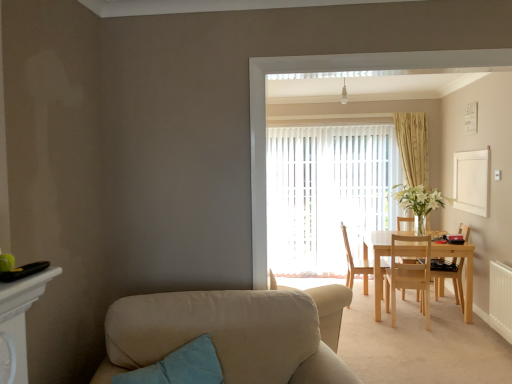
In order to face teal fabric pillow at lower left, should I rotate leftwards or rightwards?

You should rotate left by 31.275 degrees.

What is the approximate height of white vertical blinds at center?

white vertical blinds at center is 6.63 feet in height.

What is the approximate width of teal fabric pillow at lower left?

35.31 centimeters.

Measure the distance between light wood chair at right, the third chair when ordered from left to right, and camera.

The distance of light wood chair at right, the third chair when ordered from left to right, from camera is 3.97 meters.

What is the approximate width of beige textured curtain at center?

The width of beige textured curtain at center is 5.04 inches.

Find the location of a particular element. light wood table at center is located at coordinates (379, 259).

I want to click on light wood chair at center, which is the second chair from left to right, so click(x=409, y=271).

In order to face light wood chair at center, which is the second chair from left to right, should I rotate leftwards or rightwards?

Turn right by 19.806 degrees to look at light wood chair at center, which is the second chair from left to right.

Find the location of a particular element. This screenshot has width=512, height=384. teal fabric pillow at lower left is located at coordinates (7, 262).

Measure the distance from white textured radiator at lower right to beige textured curtain at center.

2.28 meters.

Where is `curtain that appears above the white textured radiator at lower right (from a real-world perspective)`? The width and height of the screenshot is (512, 384). curtain that appears above the white textured radiator at lower right (from a real-world perspective) is located at coordinates (413, 146).

Is white textured radiator at lower right aimed at beige textured curtain at center?

No, white textured radiator at lower right is not facing towards beige textured curtain at center.

Considering the relative sizes of beige fabric couch at lower left and light wood chair at center, which ranks as the first chair in left-to-right order, in the image provided, is beige fabric couch at lower left bigger than light wood chair at center, which ranks as the first chair in left-to-right order,?

Yes, beige fabric couch at lower left is bigger than light wood chair at center, which ranks as the first chair in left-to-right order.

Considering the sizes of objects beige fabric couch at lower left and light wood chair at center, the 3th chair when ordered from right to left, in the image provided, who is shorter, beige fabric couch at lower left or light wood chair at center, the 3th chair when ordered from right to left,?

beige fabric couch at lower left is shorter.

Is beige fabric couch at lower left wider than light wood chair at center, the 3th chair when ordered from right to left?

Indeed, beige fabric couch at lower left has a greater width compared to light wood chair at center, the 3th chair when ordered from right to left.

Is beige fabric couch at lower left situated inside light wood chair at center, the 3th chair when ordered from right to left, or outside?

beige fabric couch at lower left cannot be found inside light wood chair at center, the 3th chair when ordered from right to left.

Does teal fabric pillow at lower left appear on the right side of light wood chair at right, the 1th chair in the right-to-left sequence?

Incorrect, teal fabric pillow at lower left is not on the right side of light wood chair at right, the 1th chair in the right-to-left sequence.

Is teal fabric pillow at lower left shorter than light wood chair at right, the third chair when ordered from left to right?

Yes, teal fabric pillow at lower left is shorter than light wood chair at right, the third chair when ordered from left to right.

Is teal fabric pillow at lower left not close to light wood chair at right, the 1th chair in the right-to-left sequence?

teal fabric pillow at lower left is far away from light wood chair at right, the 1th chair in the right-to-left sequence.

Find the location of a particular element. pillow on the left of white vertical blinds at center is located at coordinates (180, 366).

From a real-world perspective, relative to teal fabric pillow at lower left, is white vertical blinds at center vertically above or below?

Clearly, from a real-world perspective, white vertical blinds at center is above teal fabric pillow at lower left.

Is teal fabric pillow at lower left at the back of white vertical blinds at center?

That's not correct — white vertical blinds at center is not looking away from teal fabric pillow at lower left.

Looking at the image, does white vertical blinds at center seem bigger or smaller compared to teal fabric pillow at lower left?

white vertical blinds at center is bigger than teal fabric pillow at lower left.

Does light wood chair at center, arranged as the 2th chair when viewed from the right, turn towards white textured radiator at lower right?

No.

Based on their sizes in the image, would you say light wood chair at center, arranged as the 2th chair when viewed from the right, is bigger or smaller than white textured radiator at lower right?

Clearly, light wood chair at center, arranged as the 2th chair when viewed from the right, is larger in size than white textured radiator at lower right.

Which is correct: light wood chair at center, which is the second chair from left to right, is inside white textured radiator at lower right, or outside of it?

light wood chair at center, which is the second chair from left to right, is outside white textured radiator at lower right.

Which of these two, light wood chair at center, which is the second chair from left to right, or white textured radiator at lower right, is wider?

light wood chair at center, which is the second chair from left to right.

Does point (384, 267) appear closer or farther from the camera than point (507, 340)?

Point (384, 267) is positioned farther from the camera compared to point (507, 340).

How different are the orientations of light wood chair at center, the 3th chair when ordered from right to left, and white textured radiator at lower right in degrees?

176 degrees.

From a real-world perspective, which is physically above, light wood chair at center, the 3th chair when ordered from right to left, or white textured radiator at lower right?

From a 3D spatial view, light wood chair at center, the 3th chair when ordered from right to left, is above.

Does light wood chair at center, which ranks as the first chair in left-to-right order, have a smaller size compared to white textured radiator at lower right?

No, light wood chair at center, which ranks as the first chair in left-to-right order, is not smaller than white textured radiator at lower right.

Considering the sizes of objects beige fabric couch at lower left and light wood chair at center, arranged as the 2th chair when viewed from the right, in the image provided, who is bigger, beige fabric couch at lower left or light wood chair at center, arranged as the 2th chair when viewed from the right,?

beige fabric couch at lower left.

Does beige fabric couch at lower left have a greater height compared to light wood chair at center, which is the second chair from left to right?

No.

From the picture: From a real-world perspective, is beige fabric couch at lower left above or below light wood chair at center, which is the second chair from left to right?

Clearly, from a real-world perspective, beige fabric couch at lower left is above light wood chair at center, which is the second chair from left to right.

Is beige fabric couch at lower left turned away from light wood chair at center, arranged as the 2th chair when viewed from the right?

That's not correct — beige fabric couch at lower left is not looking away from light wood chair at center, arranged as the 2th chair when viewed from the right.

Where is `radiator on the right of beige textured curtain at center`? This screenshot has width=512, height=384. radiator on the right of beige textured curtain at center is located at coordinates (500, 299).

Where is `studio couch that appears below the light wood chair at center, which ranks as the first chair in left-to-right order (from the image's perspective)`? This screenshot has height=384, width=512. studio couch that appears below the light wood chair at center, which ranks as the first chair in left-to-right order (from the image's perspective) is located at coordinates (230, 334).

Based on their spatial positions, is teal fabric pillow at lower left or teal fabric pillow at lower left further from light wood chair at center, which is the second chair from left to right?

Among the two, teal fabric pillow at lower left is located further to light wood chair at center, which is the second chair from left to right.

Estimate the real-world distances between objects in this image. Which object is closer to light wood chair at right, the 1th chair in the right-to-left sequence, white vertical blinds at center or light wood table at center?

Among the two, light wood table at center is located nearer to light wood chair at right, the 1th chair in the right-to-left sequence.

Estimate the real-world distances between objects in this image. Which object is closer to teal fabric pillow at lower left, light wood chair at right, the 1th chair in the right-to-left sequence, or light wood table at center?

light wood table at center lies closer to teal fabric pillow at lower left than the other object.

Looking at the image, which one is located further to light wood chair at center, which ranks as the first chair in left-to-right order, white vertical blinds at center or beige fabric couch at lower left?

Among the two, beige fabric couch at lower left is located further to light wood chair at center, which ranks as the first chair in left-to-right order.

Estimate the real-world distances between objects in this image. Which object is closer to white textured radiator at lower right, light wood chair at right, the third chair when ordered from left to right, or beige textured curtain at center?

light wood chair at right, the third chair when ordered from left to right, is positioned closer to the anchor white textured radiator at lower right.

Which object lies further to the anchor point white vertical blinds at center, white textured radiator at lower right or beige fabric couch at lower left?

Among the two, beige fabric couch at lower left is located further to white vertical blinds at center.

Which object lies further to the anchor point white vertical blinds at center, teal fabric pillow at lower left or beige fabric couch at lower left?

Based on the image, teal fabric pillow at lower left appears to be further to white vertical blinds at center.

In the scene shown: Considering their positions, is beige fabric couch at lower left positioned further to white textured radiator at lower right than white vertical blinds at center?

Based on the image, beige fabric couch at lower left appears to be further to white textured radiator at lower right.

Where is `kitchen & dining room table located between light wood chair at center, arranged as the 2th chair when viewed from the right, and light wood chair at center, which ranks as the first chair in left-to-right order, in the depth direction`? kitchen & dining room table located between light wood chair at center, arranged as the 2th chair when viewed from the right, and light wood chair at center, which ranks as the first chair in left-to-right order, in the depth direction is located at coordinates (379, 259).

Where is `radiator between beige fabric couch at lower left and beige textured curtain at center in the front-back direction`? The image size is (512, 384). radiator between beige fabric couch at lower left and beige textured curtain at center in the front-back direction is located at coordinates (500, 299).

This screenshot has width=512, height=384. I want to click on kitchen & dining room table positioned between beige fabric couch at lower left and light wood chair at right, the 1th chair in the right-to-left sequence, from near to far, so click(x=379, y=259).

Find the location of a particular element. Image resolution: width=512 pixels, height=384 pixels. pillow located between teal fabric pillow at lower left and beige textured curtain at center in the depth direction is located at coordinates (180, 366).